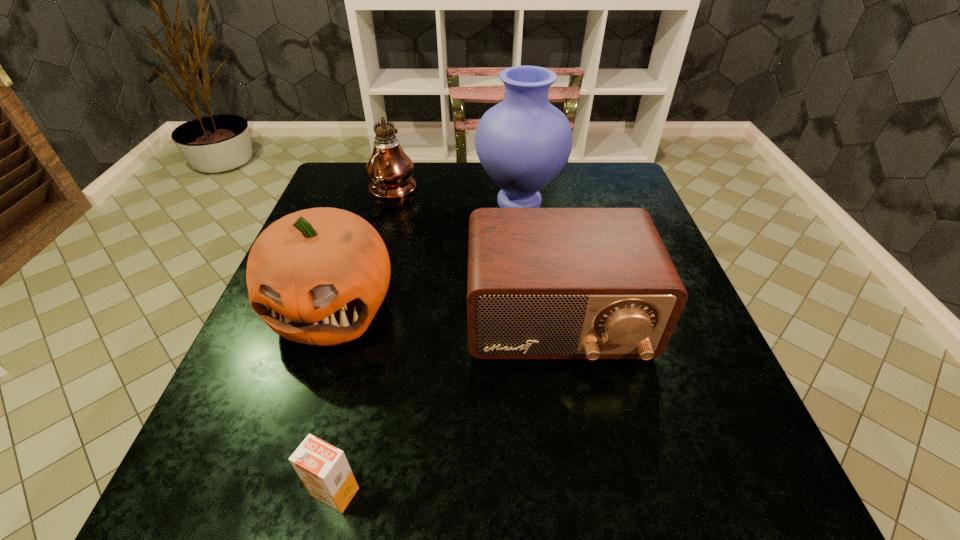
Where is `free location at the left edge of the desktop`? The width and height of the screenshot is (960, 540). free location at the left edge of the desktop is located at coordinates (231, 437).

I want to click on vacant space at the far left corner, so click(349, 180).

In order to click on free space at the far right corner in this screenshot , I will do `click(621, 171)`.

At what (x,y) coordinates should I click in order to perform the action: click on free space between the radio receiver and the pumpkin. Please return your answer as a coordinate pair (x, y). Looking at the image, I should click on (444, 313).

The width and height of the screenshot is (960, 540). In order to click on free point between the pumpkin and the orange juice in this screenshot , I will do `click(334, 399)`.

This screenshot has height=540, width=960. In order to click on empty space between the oil lamp and the nearest object in this screenshot , I will do `click(364, 341)`.

The image size is (960, 540). Find the location of `unoccupied position between the pumpkin and the shortest object`. unoccupied position between the pumpkin and the shortest object is located at coordinates (334, 399).

The height and width of the screenshot is (540, 960). What are the coordinates of `vacant area between the nearest object and the radio receiver` in the screenshot? It's located at (446, 407).

Image resolution: width=960 pixels, height=540 pixels. What are the coordinates of `vacant space in between the pumpkin and the orange juice` in the screenshot? It's located at (334, 399).

You are a GUI agent. You are given a task and a screenshot of the screen. Output one action in this format:
    pyautogui.click(x=<x>, y=<y>)
    Task: Click on the free area in between the vase and the oil lamp
    
    Given the screenshot: What is the action you would take?
    pyautogui.click(x=456, y=197)